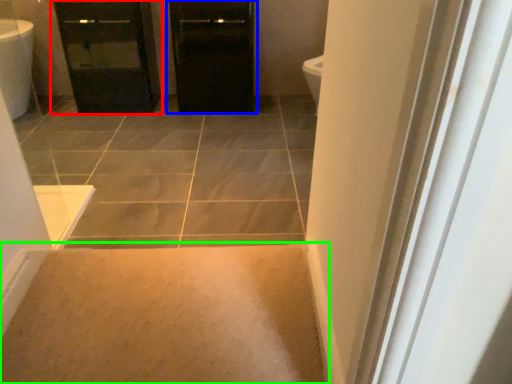
Question: Considering the real-world distances, which object is farthest from bathroom cabinet (highlighted by a red box)? door (highlighted by a blue box) or plain (highlighted by a green box)?

Choices:
 (A) door
 (B) plain

Answer: (B)